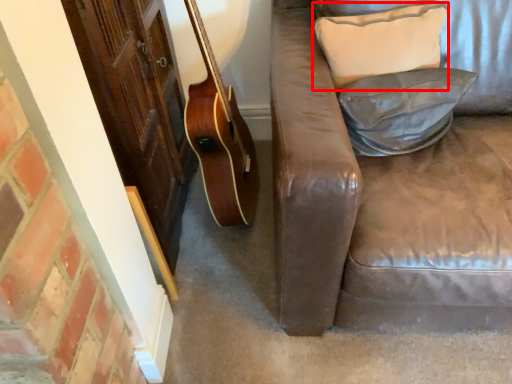
Question: Where is pillow (annotated by the red box) located in relation to pillow in the image?

Choices:
 (A) right
 (B) left

Answer: (B)